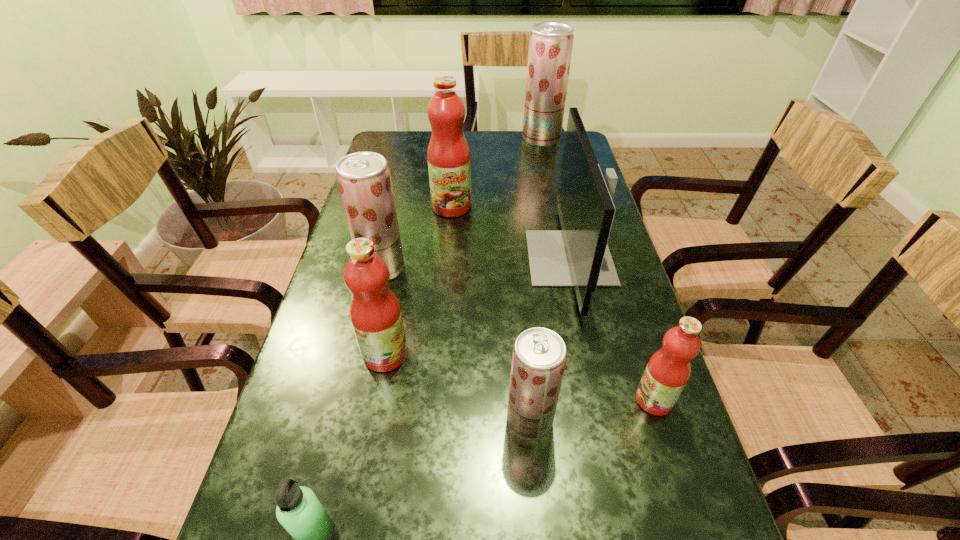
I want to click on vacant space that is in between the computer monitor and the nearest pink fruit juice, so click(x=612, y=329).

Where is `empty space that is in between the rightmost pink fruit juice and the computer monitor`? empty space that is in between the rightmost pink fruit juice and the computer monitor is located at coordinates (612, 329).

What are the coordinates of `unoccupied position between the farthest fruit juice and the leftmost pink fruit juice` in the screenshot? It's located at (464, 247).

Where is `vacant space that is in between the computer monitor and the biggest strawberry fruit juice`? Image resolution: width=960 pixels, height=540 pixels. vacant space that is in between the computer monitor and the biggest strawberry fruit juice is located at coordinates pos(556,198).

Find the location of `free space between the fifth object from right to left and the leftmost strawberry fruit juice`. free space between the fifth object from right to left and the leftmost strawberry fruit juice is located at coordinates (417, 238).

The image size is (960, 540). Identify the location of vacant area that lies between the nearest strawberry fruit juice and the rightmost pink fruit juice. (591, 410).

Locate an element on the screen. object that is the fifth closest to the nearest object is located at coordinates (668, 370).

Identify the location of the seventh closest object to the second strawberry fruit juice from left to right. The width and height of the screenshot is (960, 540). (550, 48).

At what (x,y) coordinates should I click in order to perform the action: click on the fifth closest fruit juice relative to the fourth farthest fruit juice. Please return your answer as a coordinate pair (x, y). Image resolution: width=960 pixels, height=540 pixels. Looking at the image, I should click on (550, 48).

Where is `fruit juice that is the sixth nearest to the thermos bottle`? This screenshot has width=960, height=540. fruit juice that is the sixth nearest to the thermos bottle is located at coordinates (550, 48).